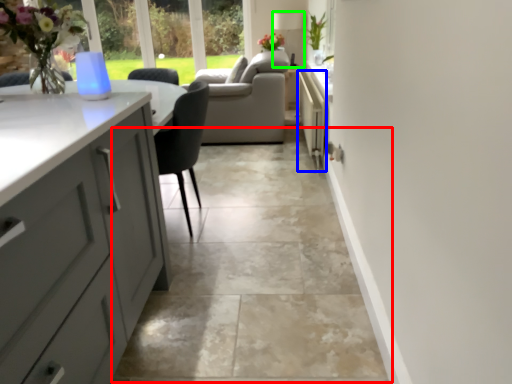
Question: Considering the real-world distances, which object is farthest from path (highlighted by a red box)? appliance (highlighted by a blue box) or lamp (highlighted by a green box)?

Choices:
 (A) appliance
 (B) lamp

Answer: (B)